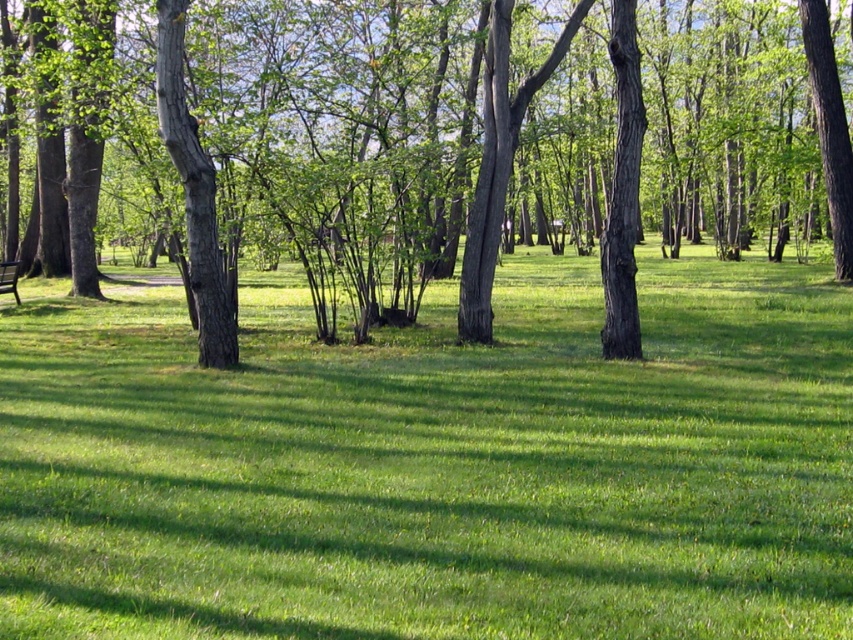
Question: Where is green grassy at center located in relation to brown rough tree at center in the image?

Choices:
 (A) left
 (B) right

Answer: (B)

Question: Which object appears closest to the camera in this image?

Choices:
 (A) green grassy at center
 (B) brown rough tree at center

Answer: (A)

Question: Considering the relative positions of green grassy at center and brown rough tree at center in the image provided, where is green grassy at center located with respect to brown rough tree at center?

Choices:
 (A) below
 (B) above

Answer: (A)

Question: Does green grassy at center have a greater width compared to brown rough tree at center?

Choices:
 (A) no
 (B) yes

Answer: (A)

Question: Which point appears farthest from the camera in this image?

Choices:
 (A) (30, 378)
 (B) (368, 232)

Answer: (B)